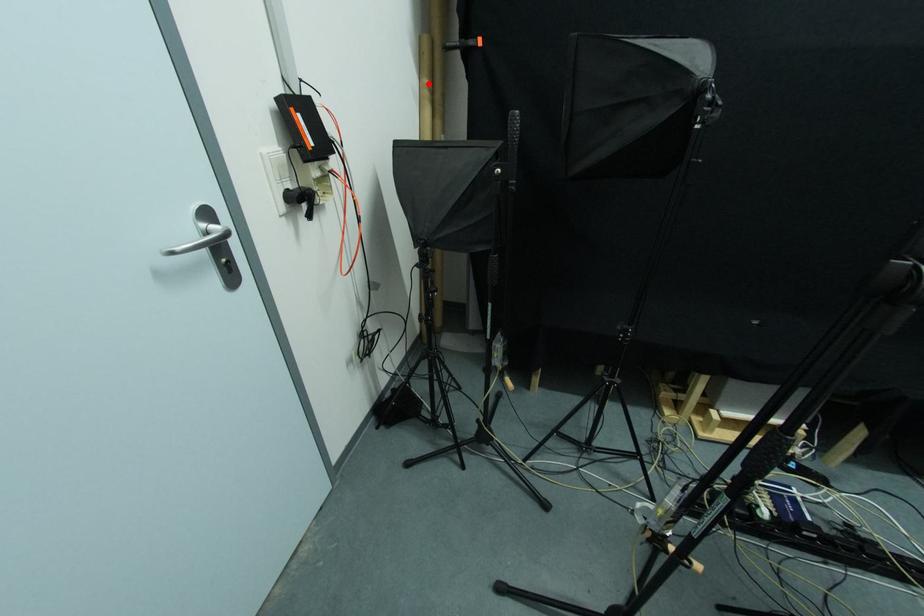
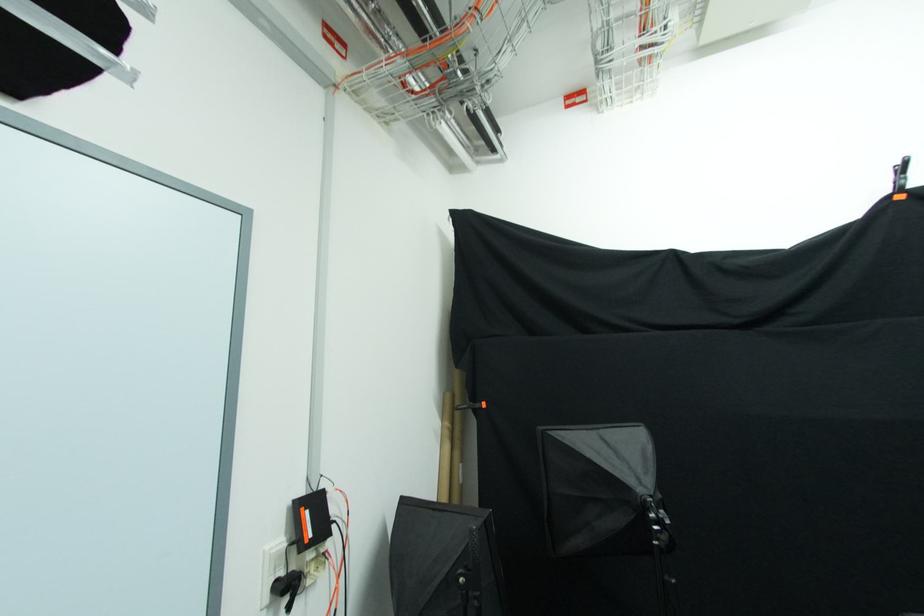
The point at the highlighted location is marked in the first image. Where is the corresponding point in the second image?

(448, 427)